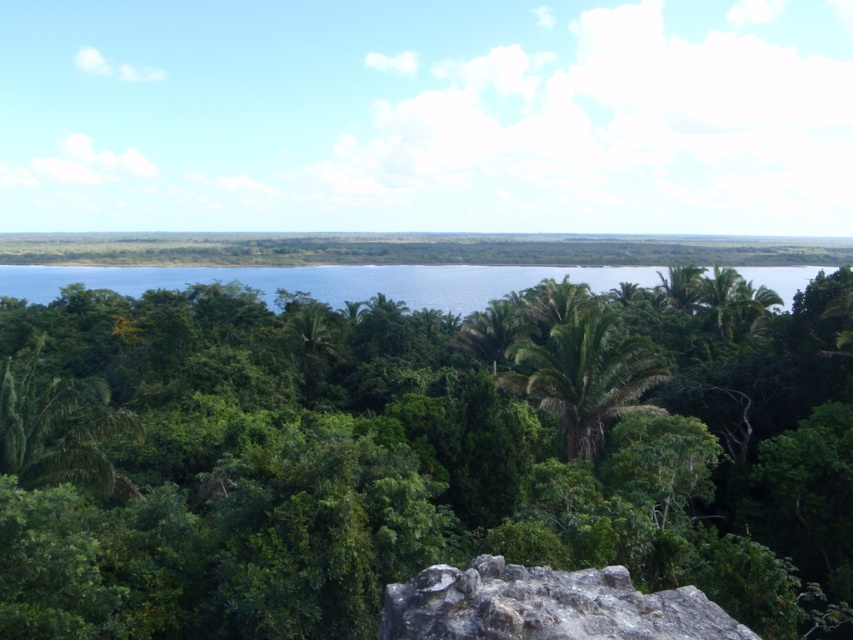
Who is shorter, green leafy tree at center or green leafy palm tree at center?

green leafy palm tree at center

Is green leafy tree at center in front of green leafy palm tree at center?

Yes.

Locate an element on the screen. This screenshot has height=640, width=853. green leafy tree at center is located at coordinates click(x=418, y=452).

Can you confirm if green leafy tree at center is bigger than blue glassy water at center?

Actually, green leafy tree at center might be smaller than blue glassy water at center.

Between green leafy tree at center and blue glassy water at center, which one appears on the right side from the viewer's perspective?

From the viewer's perspective, blue glassy water at center appears more on the right side.

Which is behind, point (59, 307) or point (32, 291)?

Positioned behind is point (32, 291).

Find the location of a particular element. The height and width of the screenshot is (640, 853). green leafy tree at center is located at coordinates [x=418, y=452].

Does blue glassy water at center have a smaller size compared to green leafy palm tree at center?

No.

Is blue glassy water at center positioned in front of green leafy palm tree at center?

No, blue glassy water at center is behind green leafy palm tree at center.

Identify the location of blue glassy water at center. This screenshot has width=853, height=640. (325, 280).